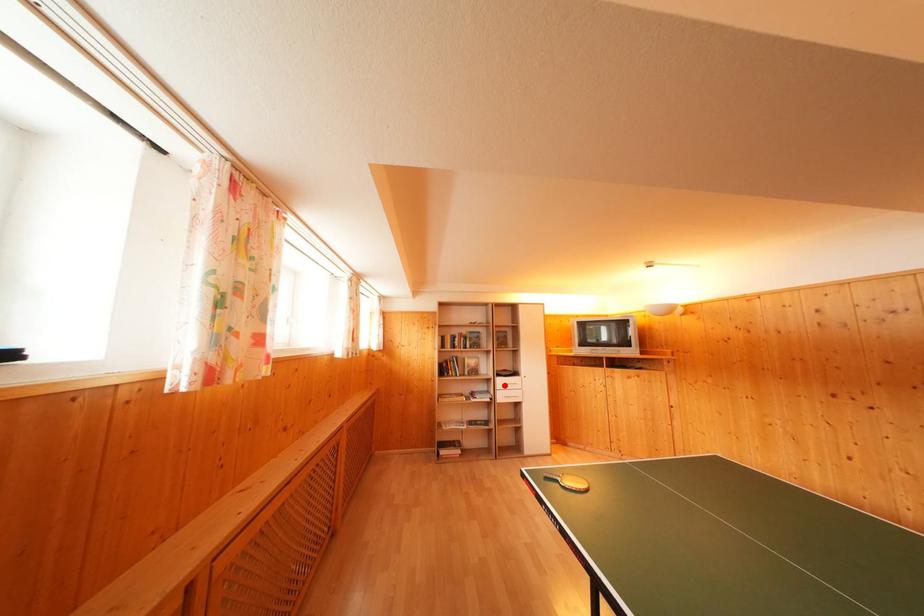
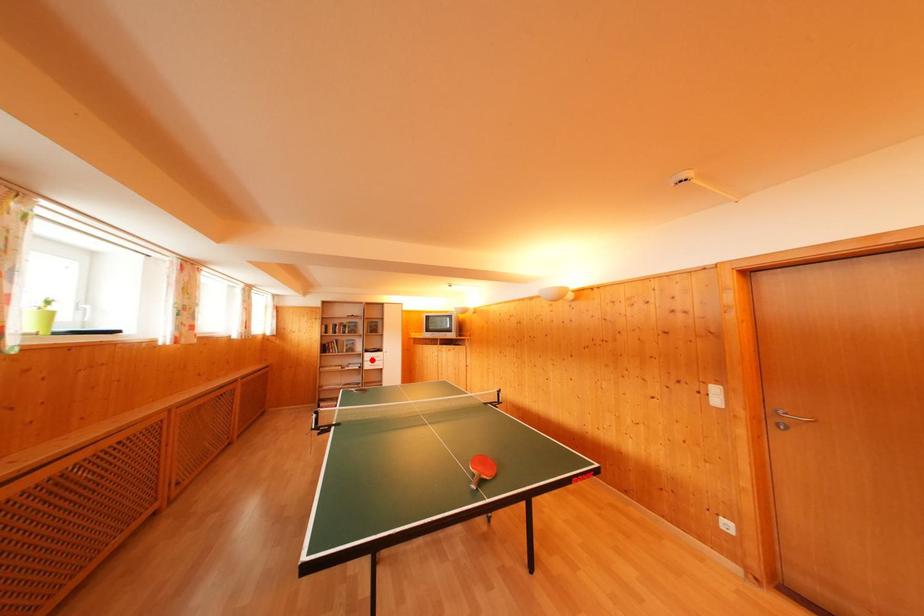
I am providing you with two images of the same scene from different viewpoints. A red point is marked on the first image and another point is marked on the second image. Is the red point in image1 aligned with the point shown in image2?

Yes